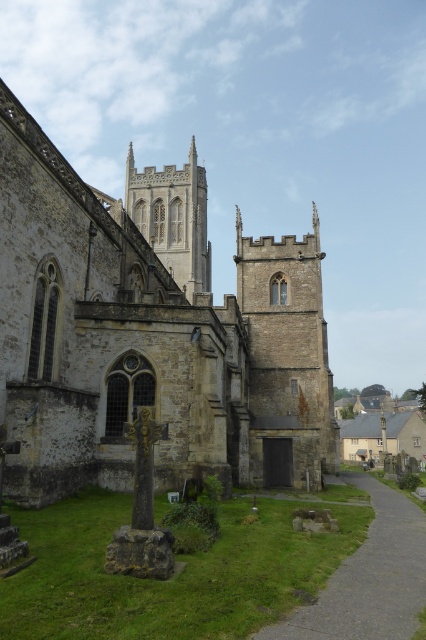
Between stone church at center and stone spire at center, which one is positioned higher?

stone spire at center is above.

Between stone church at center and stone spire at center, which one appears on the right side from the viewer's perspective?

stone church at center

Which is behind, point (71, 349) or point (172, 260)?

Positioned behind is point (172, 260).

At what (x,y) coordinates should I click in order to perform the action: click on stone church at center. Please return your answer as a coordinate pair (x, y). Looking at the image, I should click on (149, 332).

Looking at this image, between stone church at center and brown gravel path at lower center, which one has less height?

brown gravel path at lower center is shorter.

Is point (189, 168) farther from camera compared to point (363, 611)?

Yes.

Find the location of `stone church at center`. stone church at center is located at coordinates (149, 332).

Does brown gravel path at lower center have a lesser height compared to stone spire at center?

Correct, brown gravel path at lower center is not as tall as stone spire at center.

Who is more distant from viewer, [368,486] or [138,208]?

The point [138,208] is behind.

What are the coordinates of `brown gravel path at lower center` in the screenshot? It's located at (368, 577).